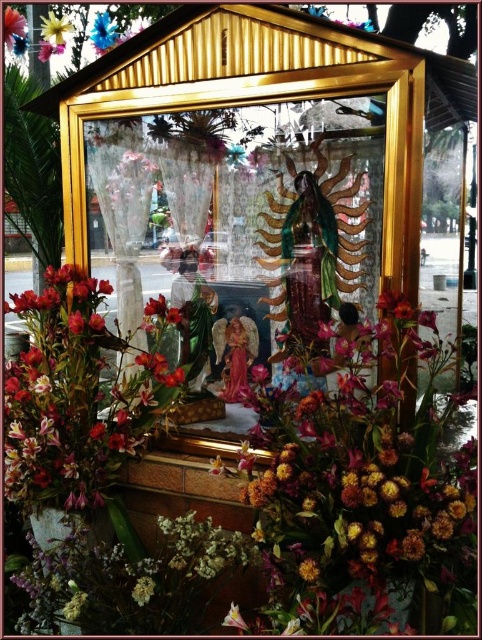
Question: Which of the following is the farthest from the observer?

Choices:
 (A) blue silk flower at upper left
 (B) yellow fabric flower at upper left
 (C) gold/glass statue at center
 (D) silky pink orchid at center

Answer: (A)

Question: Considering the real-world distances, which object is closest to the gold/glass statue at center?

Choices:
 (A) silky pink orchid at center
 (B) matte pink flower at upper left
 (C) matte pink orchid at center

Answer: (A)

Question: Which object is the farthest from the yellow fabric flower at upper left?

Choices:
 (A) gold/glass statue at center
 (B) matte pink flower at upper left
 (C) blue silk flower at upper left

Answer: (A)

Question: Is gold/glass statue at center wider than matte pink orchid at center?

Choices:
 (A) no
 (B) yes

Answer: (B)

Question: Is blue silk flower at upper left smaller than matte pink flower at upper left?

Choices:
 (A) yes
 (B) no

Answer: (B)

Question: Does gold/glass statue at center have a smaller size compared to matte pink orchid at center?

Choices:
 (A) no
 (B) yes

Answer: (A)